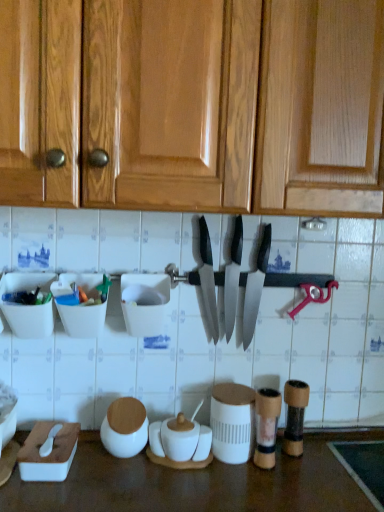
Question: Is white matte jar at lower center, positioned as the 5th tableware in right-to-left order, in front of or behind wooden textured salt and pepper shakers at lower center, which appears as the 6th tableware when viewed from the left, in the image?

Choices:
 (A) behind
 (B) front

Answer: (B)

Question: Is point (125, 444) positioned closer to the camera than point (291, 407)?

Choices:
 (A) farther
 (B) closer

Answer: (B)

Question: Estimate the real-world distances between objects in this image. Which object is closer to the polished silver knife at center, the second kitchen knife positioned from the right?

Choices:
 (A) white matte container at center, which is the 4th tableware in left-to-right order
 (B) wooden textured salt and pepper shakers at lower center, marked as the first tableware in a right-to-left arrangement
 (C) white matte jar at lower center, marked as the 2th tableware in a left-to-right arrangement
 (D) wooden salt and pepper shakers at center, which is the fifth tableware from left to right
 (E) matte black knife at center, arranged as the 1th kitchen knife when viewed from the right

Answer: (E)

Question: Considering the real-world distances, which object is farthest from the white plastic container at center, the fourth tableware viewed from the right?

Choices:
 (A) translucent plastic container at left, the 6th tableware viewed from the right
 (B) white matte jar at lower center, positioned as the 5th tableware in right-to-left order
 (C) matte black knife at center, which appears as the third kitchen knife when viewed from the left
 (D) wooden salt and pepper shakers at center, which appears as the second tableware when viewed from the right
 (E) polished silver knife at center, which is counted as the 2th kitchen knife, starting from the left

Answer: (D)